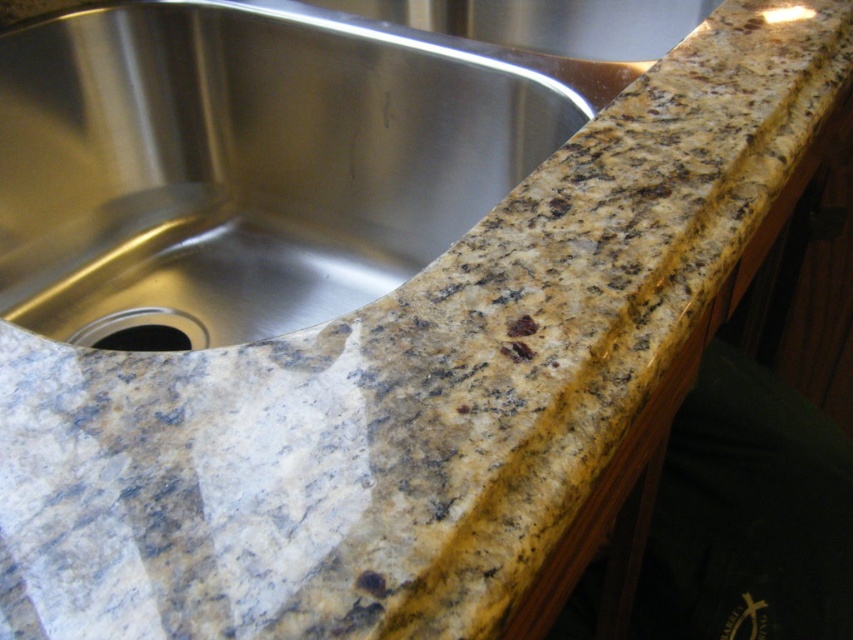
Looking at this image, you are a kitchen designer planning to install a new faucet. You see the stainless steel sink at upper left and the black granite drain at lower left. Which object is closer to you, the observer?

The stainless steel sink at upper left is closer to you than the black granite drain at lower left because it is in front of it.

You are standing in the kitchen and want to reach a point on the countertop. The point is located at coordinates point (252, 220). If your arm can extend 90 centimeters, can you reach that point?

The point (252, 220) is 92.67 centimeters away from you, so your arm cannot reach it since it can only extend 90 centimeters.

You are a kitchen designer who needs to install a faucet next to the stainless steel sink at upper left. The faucet requires a minimum of 18 inches of space between the faucet and the sink. Can you install the faucet in this location?

The distance between the stainless steel sink at upper left and the viewer is 25.41 inches. Since the faucet requires 18 inches of space between the faucet and the sink, and the current distance is more than 18 inches, the faucet can be installed in this location.